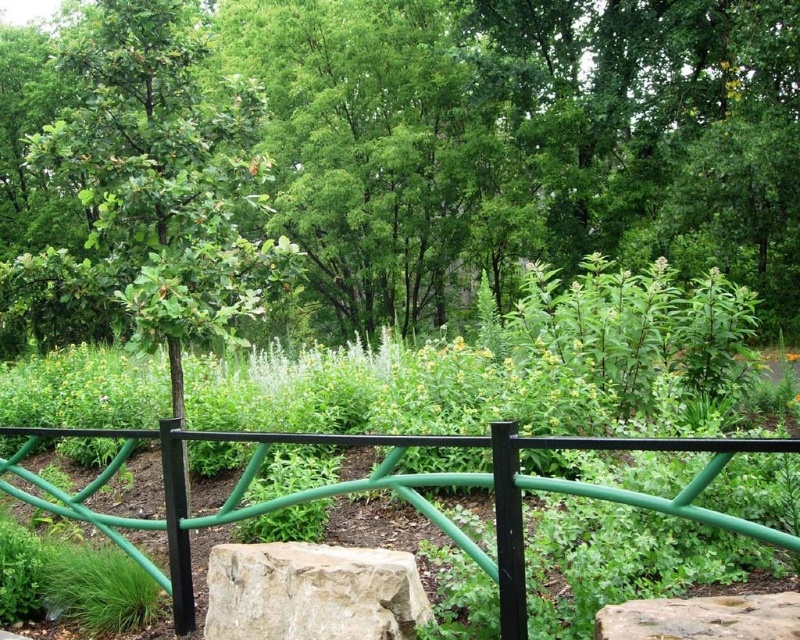
Question: Is green painted metal fence at center below smooth gray rock at lower right?

Choices:
 (A) yes
 (B) no

Answer: (B)

Question: Estimate the real-world distances between objects in this image. Which object is closer to the smooth gray rock at lower right?

Choices:
 (A) green painted metal fence at center
 (B) green leafy tree at center

Answer: (A)

Question: Which of the following is the farthest from the observer?

Choices:
 (A) smooth gray rock at lower right
 (B) green painted metal fence at center
 (C) green leafy tree at center
 (D) beige rough stone boulder at center

Answer: (C)

Question: Which point is closer to the camera?

Choices:
 (A) (262, 545)
 (B) (626, 614)

Answer: (B)

Question: Can you confirm if beige rough stone boulder at center is positioned above smooth gray rock at lower right?

Choices:
 (A) no
 (B) yes

Answer: (A)

Question: Can you confirm if green painted metal fence at center is smaller than beige rough stone boulder at center?

Choices:
 (A) yes
 (B) no

Answer: (B)